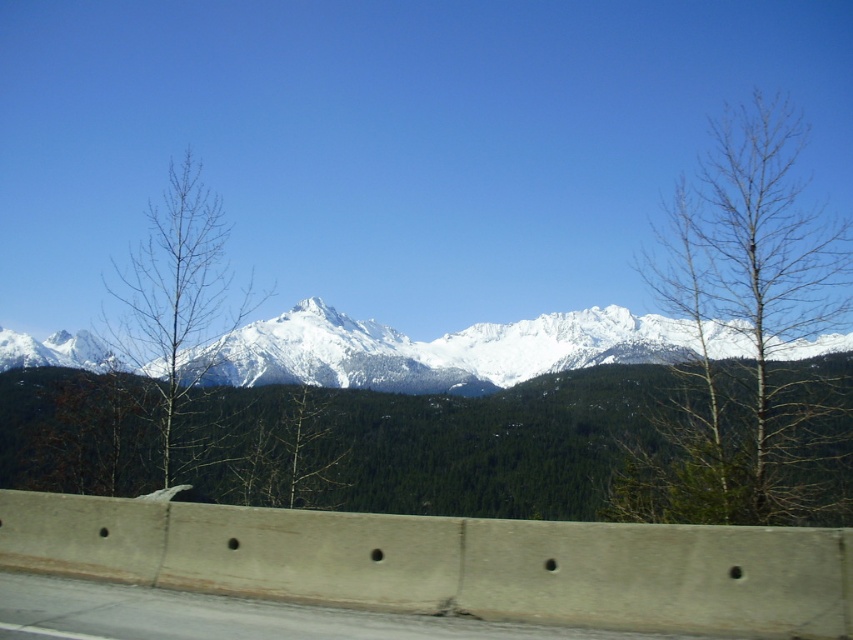
You are standing at the roadside and want to take a photo of the snow capped mountains in the background. There is a bare wood tree at right in the foreground. To ensure the tree is in focus along with the mountains, should you adjust your camera focus to a longer or shorter distance?

The bare wood tree at right is 74.90 feet away from the camera. To have both the tree and the distant mountains in focus, you should adjust the camera focus to a longer distance so that the depth of field can cover both the foreground and background elements.

Consider the image. You are a hiker standing at the center of the image and want to take a photo of both the bare wood tree at right and the bare wood tree at left. Which tree is positioned higher in the frame?

The bare wood tree at right is positioned higher in the frame than the bare wood tree at left.

You are a photographer planning to capture the scenic mountain view with both the bare wood tree at right and the bare wood tree at left in the frame. Which tree should you position closer to the edge of the frame to ensure both are fully visible?

You should position the bare wood tree at left closer to the edge of the frame because it is narrower than the bare wood tree at right, which is wider. This arrangement allows both trees to fit within the frame without being cut off.